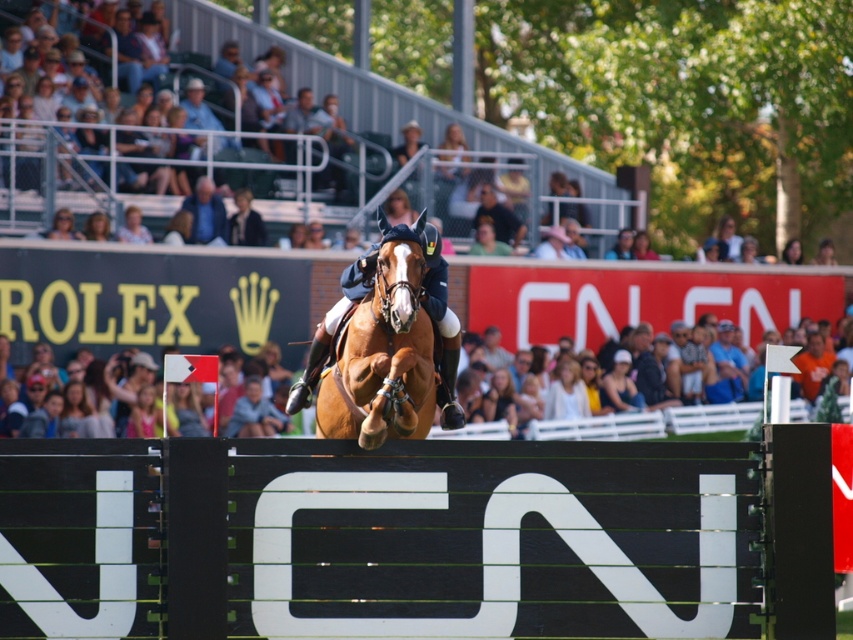
Is point (352, 390) less distant than point (579, 394)?

Yes, point (352, 390) is in front of point (579, 394).

Identify the location of glossy brown horse at center. (386, 346).

Does black plastic hurdle at center have a greater width compared to white cotton shirt at center?

Yes.

What do you see at coordinates (408, 538) in the screenshot? Image resolution: width=853 pixels, height=640 pixels. I see `black plastic hurdle at center` at bounding box center [408, 538].

Identify the location of black plastic hurdle at center. This screenshot has height=640, width=853. (408, 538).

Can you confirm if white cotton shirt at center is smaller than light brown hair at center?

Incorrect, white cotton shirt at center is not smaller in size than light brown hair at center.

Between point (560, 436) and point (548, 388), which one is positioned in front?

Point (560, 436) is more forward.

At what (x,y) coordinates should I click in order to perform the action: click on white cotton shirt at center. Please return your answer as a coordinate pair (x, y). Image resolution: width=853 pixels, height=640 pixels. Looking at the image, I should click on (691, 419).